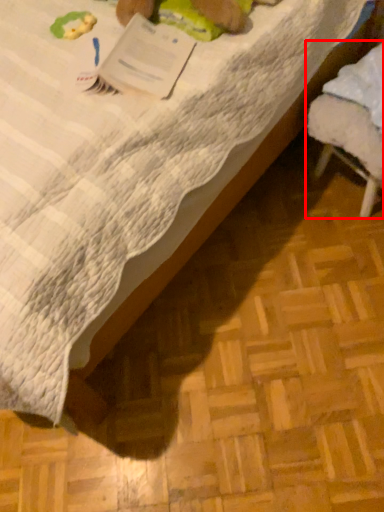
Question: Where is furniture (annotated by the red box) located in relation to paperback book in the image?

Choices:
 (A) left
 (B) right

Answer: (B)